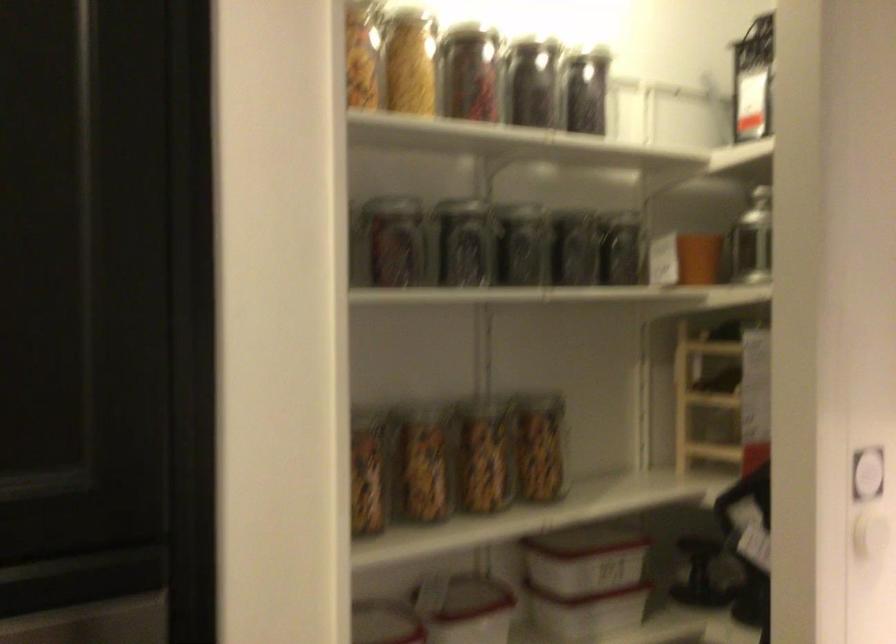
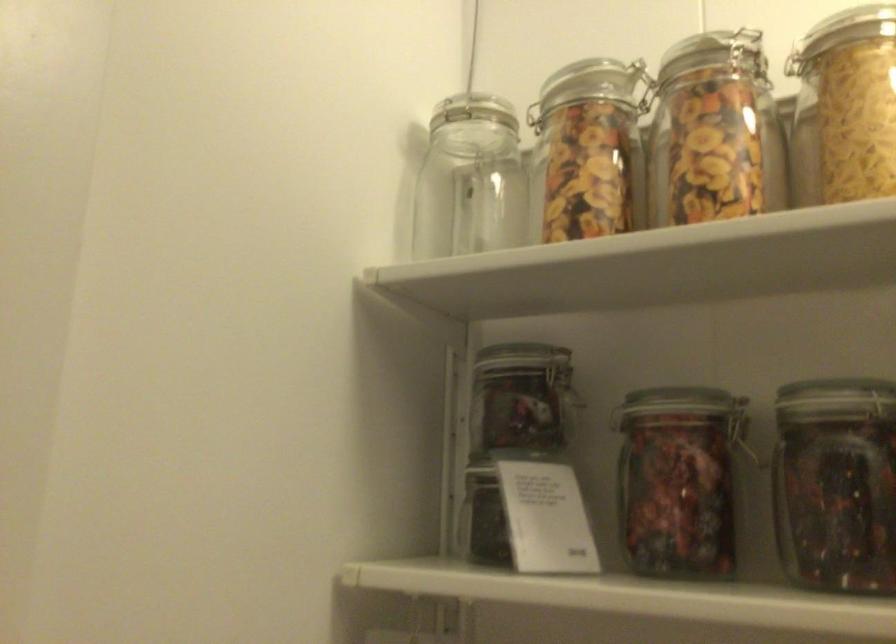
Question: The camera is either moving clockwise (left) or counter-clockwise (right) around the object. The first image is from the beginning of the video and the second image is from the end. Is the camera moving left or right when shooting the video?

Choices:
 (A) Left
 (B) Right

Answer: (B)